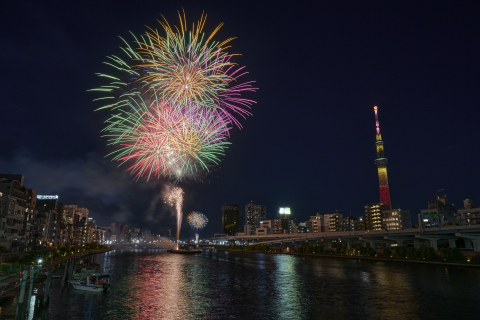
Where is `square light`? This screenshot has width=480, height=320. square light is located at coordinates (284, 211).